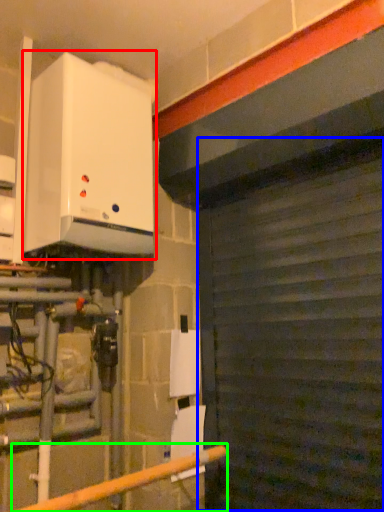
Question: Which is farther away from home appliance (highlighted by a red box)? garage door (highlighted by a blue box) or rail (highlighted by a green box)?

Choices:
 (A) garage door
 (B) rail

Answer: (B)